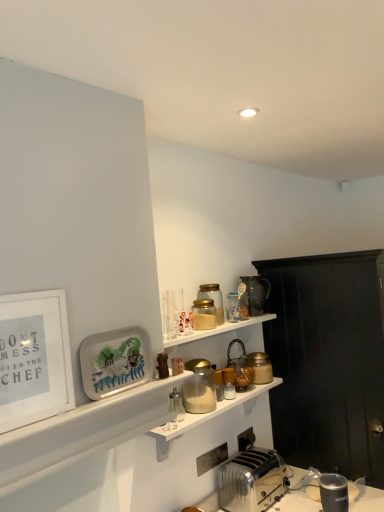
Question: Can you confirm if white glossy shelf at lower left, marked as the second shelf in a bottom-to-top arrangement, is shorter than matte plastic tray at lower left, the first picture frame positioned from the back?

Choices:
 (A) no
 (B) yes

Answer: (B)

Question: Could you tell me if white glossy shelf at lower left, the second shelf in the top-to-bottom sequence, is turned towards matte plastic tray at lower left, which is the 2th picture frame from left to right?

Choices:
 (A) yes
 (B) no

Answer: (B)

Question: Considering the relative sizes of white glossy shelf at lower left, the second shelf in the top-to-bottom sequence, and matte plastic tray at lower left, the second picture frame in the front-to-back sequence, in the image provided, is white glossy shelf at lower left, the second shelf in the top-to-bottom sequence, wider than matte plastic tray at lower left, the second picture frame in the front-to-back sequence,?

Choices:
 (A) yes
 (B) no

Answer: (A)

Question: Is white glossy shelf at lower left, the second shelf in the top-to-bottom sequence, outside matte plastic tray at lower left, the first picture frame positioned from the back?

Choices:
 (A) yes
 (B) no

Answer: (A)

Question: From the image's perspective, is white glossy shelf at lower left, the second shelf in the top-to-bottom sequence, above matte plastic tray at lower left, the second picture frame in the front-to-back sequence?

Choices:
 (A) yes
 (B) no

Answer: (B)

Question: From a real-world perspective, is white glossy shelf at lower left, marked as the second shelf in a bottom-to-top arrangement, under matte plastic tray at lower left, placed as the first picture frame when sorted from right to left?

Choices:
 (A) yes
 (B) no

Answer: (A)

Question: Is metallic silver toaster at lower right, the third appliance in the front-to-back sequence, shorter than matte gold jar at upper right, which ranks as the 9th appliance in front-to-back order?

Choices:
 (A) yes
 (B) no

Answer: (B)

Question: From the image's perspective, is metallic silver toaster at lower right, the third appliance in the front-to-back sequence, above matte gold jar at upper right, the second appliance from the back?

Choices:
 (A) yes
 (B) no

Answer: (B)

Question: Does metallic silver toaster at lower right, the third appliance in the front-to-back sequence, have a larger size compared to matte gold jar at upper right, which ranks as the 9th appliance in front-to-back order?

Choices:
 (A) no
 (B) yes

Answer: (B)

Question: From a real-world perspective, is metallic silver toaster at lower right, the 8th appliance positioned from the back, positioned under matte gold jar at upper right, the second appliance from the back, based on gravity?

Choices:
 (A) yes
 (B) no

Answer: (A)

Question: Does metallic silver toaster at lower right, the 8th appliance positioned from the back, have a smaller size compared to matte gold jar at upper right, the second appliance from the back?

Choices:
 (A) yes
 (B) no

Answer: (B)

Question: Is matte gold jar at upper right, the second appliance from the back, completely or partially inside metallic silver toaster at lower right, the third appliance in the front-to-back sequence?

Choices:
 (A) yes
 (B) no

Answer: (B)

Question: From the image's perspective, is metallic silver toaster at lower right, the third appliance in the front-to-back sequence, over translucent glass jar at upper center, which ranks as the 5th appliance in front-to-back order?

Choices:
 (A) no
 (B) yes

Answer: (A)